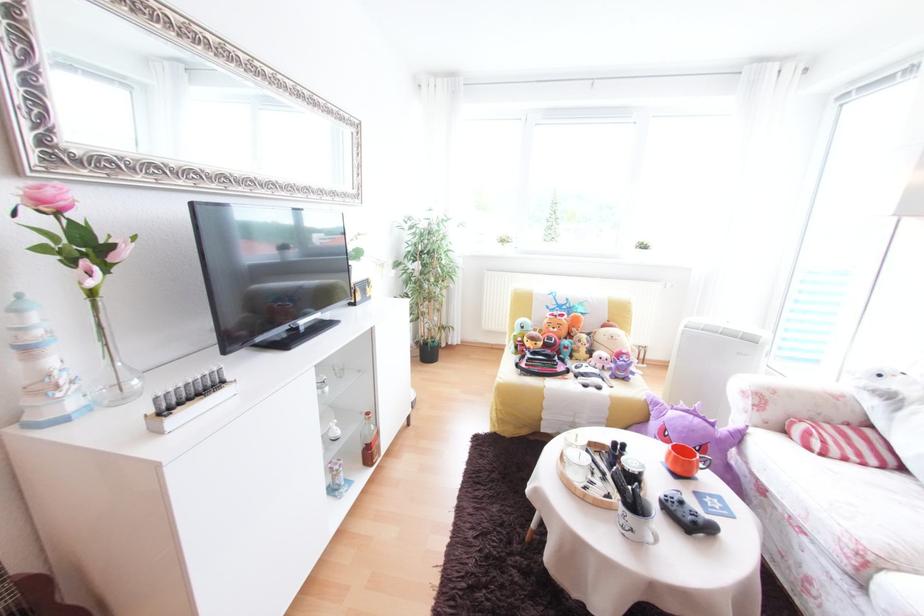
Locate an element on the screen. The width and height of the screenshot is (924, 616). floral sofa sitting surface is located at coordinates (854, 506).